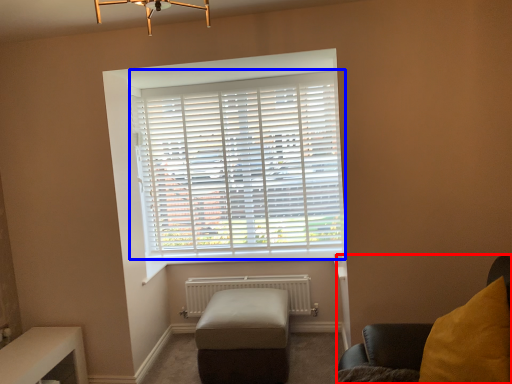
Question: Which of the following is the closest to the observer, furniture (highlighted by a red box) or window blind (highlighted by a blue box)?

Choices:
 (A) furniture
 (B) window blind

Answer: (A)